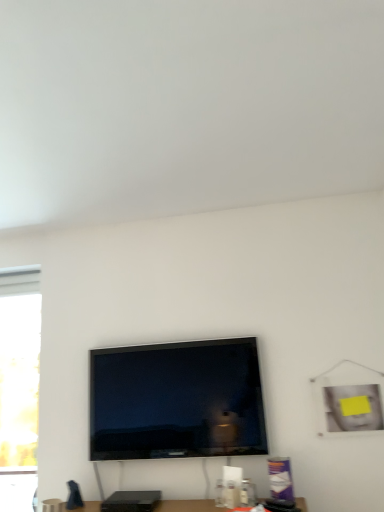
Measure the distance between matte black tv at center and camera.

They are 6.49 feet apart.

Image resolution: width=384 pixels, height=512 pixels. I want to click on matte black tv at center, so click(x=176, y=401).

Is translucent glass window at left thinner than matte black tv at center?

In fact, translucent glass window at left might be wider than matte black tv at center.

Is translucent glass window at left in contact with matte black tv at center?

There is a gap between translucent glass window at left and matte black tv at center.

Based on their sizes in the image, would you say translucent glass window at left is bigger or smaller than matte black tv at center?

In the image, translucent glass window at left appears to be smaller than matte black tv at center.

Based on their sizes in the image, would you say matte black tv at center is bigger or smaller than matte black speaker at lower center?

Considering their sizes, matte black tv at center takes up more space than matte black speaker at lower center.

Is matte black tv at center oriented towards matte black speaker at lower center?

No, matte black tv at center is not aimed at matte black speaker at lower center.

Is matte black tv at center wider than matte black speaker at lower center?

In fact, matte black tv at center might be narrower than matte black speaker at lower center.

Is matte black speaker at lower center positioned behind translucent glass window at left?

No.

How far apart are matte black speaker at lower center and translucent glass window at left?

1.13 meters.

Are matte black speaker at lower center and translucent glass window at left far apart?

Indeed, matte black speaker at lower center is not near translucent glass window at left.

How many degrees apart are the facing directions of matte black speaker at lower center and translucent glass window at left?

matte black speaker at lower center and translucent glass window at left are facing 0.435 degrees away from each other.

Consider the image. Which is behind, matte black tv at center or translucent glass window at left?

translucent glass window at left is more distant.

Choose the correct answer: Is matte black tv at center inside translucent glass window at left or outside it?

matte black tv at center is located beyond the bounds of translucent glass window at left.

Is matte black tv at center taller or shorter than translucent glass window at left?

matte black tv at center is shorter than translucent glass window at left.

From a real-world perspective, between matte black tv at center and translucent glass window at left, who is vertically higher?

From a 3D spatial view, matte black tv at center is above.

Which point is more forward, (17,277) or (58,507)?

The point (58,507) is closer to the camera.

Are translucent glass window at left and matte black speaker at lower center beside each other?

translucent glass window at left and matte black speaker at lower center are clearly separated.

The image size is (384, 512). Find the location of `furniture below the translucent glass window at left (from the image's perspective)`. furniture below the translucent glass window at left (from the image's perspective) is located at coordinates (x=189, y=506).

Could you tell me if translucent glass window at left is turned towards matte black speaker at lower center?

No, translucent glass window at left is not aimed at matte black speaker at lower center.

Which is correct: matte black speaker at lower center is inside matte black tv at center, or outside of it?

matte black speaker at lower center is spatially situated outside matte black tv at center.

Who is more distant, matte black speaker at lower center or matte black tv at center?

Positioned behind is matte black tv at center.

Locate an element on the screen. This screenshot has height=512, width=384. television on the left of the matte black speaker at lower center is located at coordinates (176, 401).

From a real-world perspective, is matte black speaker at lower center located beneath matte black tv at center?

Yes.

Find the location of `window behind the matte black tv at center`. window behind the matte black tv at center is located at coordinates (x=19, y=365).

You are a GUI agent. You are given a task and a screenshot of the screen. Output one action in this format:
    pyautogui.click(x=<x>, y=<y>)
    Task: Click on the television above the matte black speaker at lower center (from a real-world perspective)
    
    Given the screenshot: What is the action you would take?
    tap(176, 401)

Looking at the image, which one is located further to matte black speaker at lower center, matte black tv at center or translucent glass window at left?

Based on the image, translucent glass window at left appears to be further to matte black speaker at lower center.

Looking at the image, which one is located further to translucent glass window at left, matte black tv at center or matte black speaker at lower center?

The object further to translucent glass window at left is matte black speaker at lower center.

Which object lies further to the anchor point matte black tv at center, translucent glass window at left or matte black speaker at lower center?

translucent glass window at left.

When comparing their distances from matte black speaker at lower center, does translucent glass window at left or matte black tv at center seem closer?

Result: matte black tv at center is closer to matte black speaker at lower center.

From the image, which object appears to be nearer to translucent glass window at left, matte black speaker at lower center or matte black tv at center?

Based on the image, matte black tv at center appears to be nearer to translucent glass window at left.

Considering their positions, is matte black speaker at lower center positioned closer to matte black tv at center than translucent glass window at left?

Based on the image, matte black speaker at lower center appears to be nearer to matte black tv at center.

This screenshot has width=384, height=512. Find the location of `television situated between translucent glass window at left and matte black speaker at lower center from left to right`. television situated between translucent glass window at left and matte black speaker at lower center from left to right is located at coordinates (176, 401).